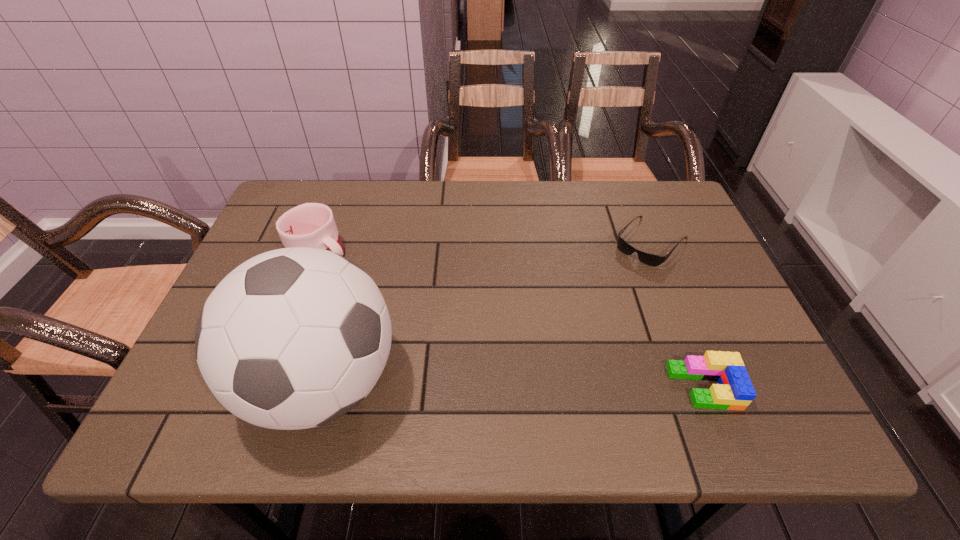
What are the coordinates of `vacant space in between the shortest object and the third tallest object` in the screenshot? It's located at (678, 314).

Where is `free space between the mug and the Lego`? free space between the mug and the Lego is located at coordinates (513, 320).

Find the location of a particular element. The height and width of the screenshot is (540, 960). free spot between the second shortest object and the second tallest object is located at coordinates (513, 320).

Select which object appears as the second closest to the second shortest object. Please provide its 2D coordinates. Your answer should be formatted as a tuple, i.e. [(x, y)], where the tuple contains the x and y coordinates of a point satisfying the conditions above.

[(294, 338)]

You are a GUI agent. You are given a task and a screenshot of the screen. Output one action in this format:
    pyautogui.click(x=<x>, y=<y>)
    Task: Click on the object that is the closest to the shortest object
    Image resolution: width=960 pixels, height=540 pixels.
    Given the screenshot: What is the action you would take?
    pyautogui.click(x=734, y=391)

Locate an element on the screen. This screenshot has width=960, height=540. free space in the image that satisfies the following two spatial constraints: 1. on the front side of the mug; 2. on the right side of the Lego is located at coordinates pyautogui.click(x=272, y=387).

The height and width of the screenshot is (540, 960). I want to click on free space in the image that satisfies the following two spatial constraints: 1. on the front side of the third tallest object; 2. on the right side of the soccer ball, so click(322, 387).

What are the coordinates of `vacant space that satisfies the following two spatial constraints: 1. on the back side of the sunglasses; 2. on the right side of the mug` in the screenshot? It's located at (324, 241).

Image resolution: width=960 pixels, height=540 pixels. I want to click on free region that satisfies the following two spatial constraints: 1. on the front side of the third tallest object; 2. on the left side of the soccer ball, so click(x=322, y=387).

I want to click on free location that satisfies the following two spatial constraints: 1. on the back side of the second tallest object; 2. on the left side of the shortest object, so coord(324,241).